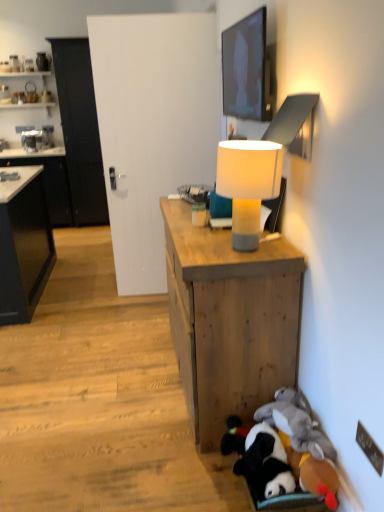
I want to click on free region on the left part of white fabric lampshade at center, so click(196, 247).